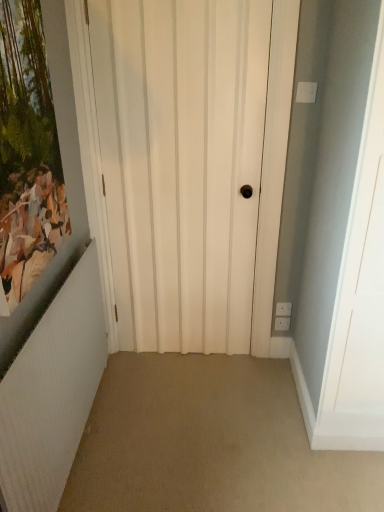
Question: Is the position of white matte door at center less distant than that of white textured radiator at left?

Choices:
 (A) no
 (B) yes

Answer: (A)

Question: Can you confirm if white matte door at center is shorter than white textured radiator at left?

Choices:
 (A) no
 (B) yes

Answer: (A)

Question: Can you confirm if white matte door at center is smaller than white textured radiator at left?

Choices:
 (A) no
 (B) yes

Answer: (B)

Question: Is white textured radiator at left located within white matte door at center?

Choices:
 (A) no
 (B) yes

Answer: (A)

Question: Is white matte door at center at the left side of white textured radiator at left?

Choices:
 (A) yes
 (B) no

Answer: (B)

Question: Can you confirm if white matte door at center is thinner than white textured radiator at left?

Choices:
 (A) no
 (B) yes

Answer: (B)

Question: Is white textured radiator at left surrounded by matte wooden picture frame at left?

Choices:
 (A) yes
 (B) no

Answer: (B)

Question: Can you confirm if matte wooden picture frame at left is positioned to the left of white textured radiator at left?

Choices:
 (A) yes
 (B) no

Answer: (A)

Question: Does matte wooden picture frame at left have a lesser width compared to white textured radiator at left?

Choices:
 (A) no
 (B) yes

Answer: (B)

Question: Is matte wooden picture frame at left outside of white textured radiator at left?

Choices:
 (A) no
 (B) yes

Answer: (B)

Question: Is matte wooden picture frame at left positioned with its back to white textured radiator at left?

Choices:
 (A) yes
 (B) no

Answer: (B)

Question: Can you see matte wooden picture frame at left touching white textured radiator at left?

Choices:
 (A) yes
 (B) no

Answer: (B)

Question: Does white textured radiator at left lie in front of white matte door at center?

Choices:
 (A) no
 (B) yes

Answer: (B)